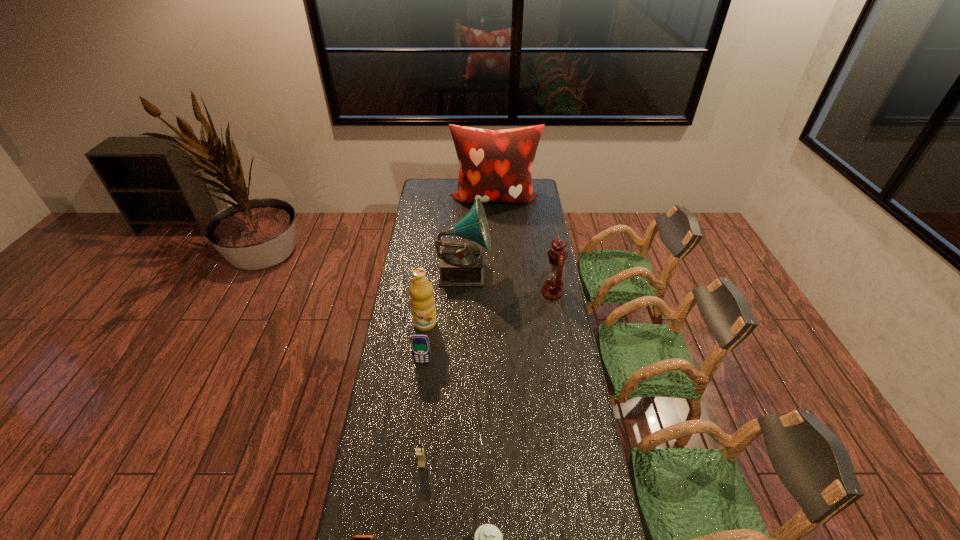
At what (x,y) coordinates should I click in order to perform the action: click on cushion. Please return your answer as a coordinate pair (x, y). This screenshot has width=960, height=540. Looking at the image, I should click on (495, 166).

The image size is (960, 540). Find the location of `the seventh shortest object`. the seventh shortest object is located at coordinates (461, 263).

Where is `oil lamp`? The image size is (960, 540). oil lamp is located at coordinates (552, 289).

In order to click on the fourth farthest object in this screenshot , I will do `click(422, 300)`.

You are a GUI agent. You are given a task and a screenshot of the screen. Output one action in this format:
    pyautogui.click(x=<x>, y=<y>)
    Task: Click on the farthest cellular telephone
    This screenshot has width=960, height=540.
    Given the screenshot: What is the action you would take?
    pyautogui.click(x=420, y=346)

Locate an element on the screen. the fourth nearest object is located at coordinates (420, 346).

The width and height of the screenshot is (960, 540). Find the location of `the third nearest object`. the third nearest object is located at coordinates (420, 454).

Find the location of a particular element. Image resolution: width=960 pixels, height=540 pixels. vacant space situated on the front-facing side of the farthest object is located at coordinates (496, 250).

At what (x,y) coordinates should I click in order to perform the action: click on vacant area situated on the horn of the seventh shortest object. Please return your answer as a coordinate pair (x, y). Looking at the image, I should click on (515, 270).

The image size is (960, 540). Identify the location of free location located on the front of the oil lamp. (560, 336).